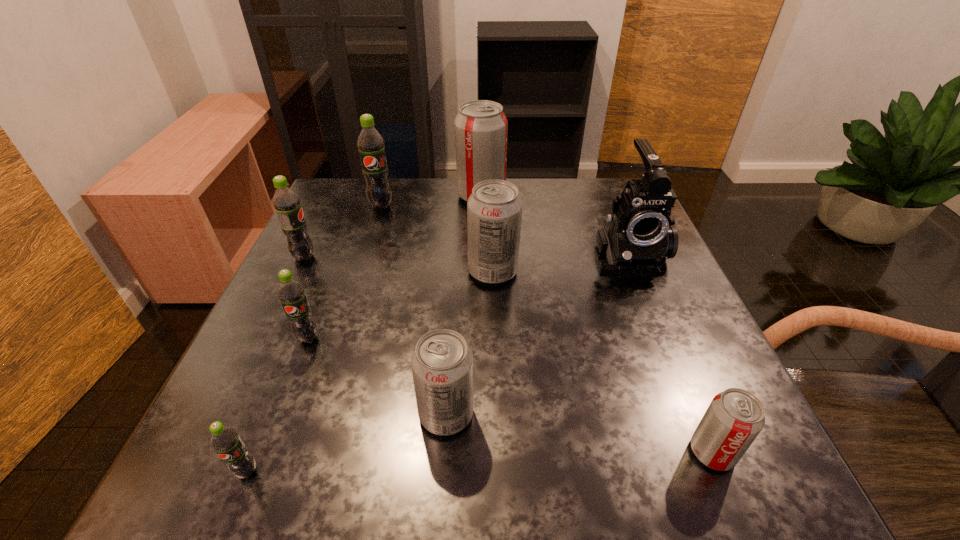
The image size is (960, 540). In order to click on vacant space that satisfies the following two spatial constraints: 1. on the front label of the second biggest green soda; 2. on the left side of the second farthest gray soda can in this screenshot , I will do pyautogui.click(x=298, y=272).

Locate an element on the screen. vacant area that satisfies the following two spatial constraints: 1. on the back side of the second farthest gray soda can; 2. on the right side of the third biggest gray soda can is located at coordinates pyautogui.click(x=456, y=272).